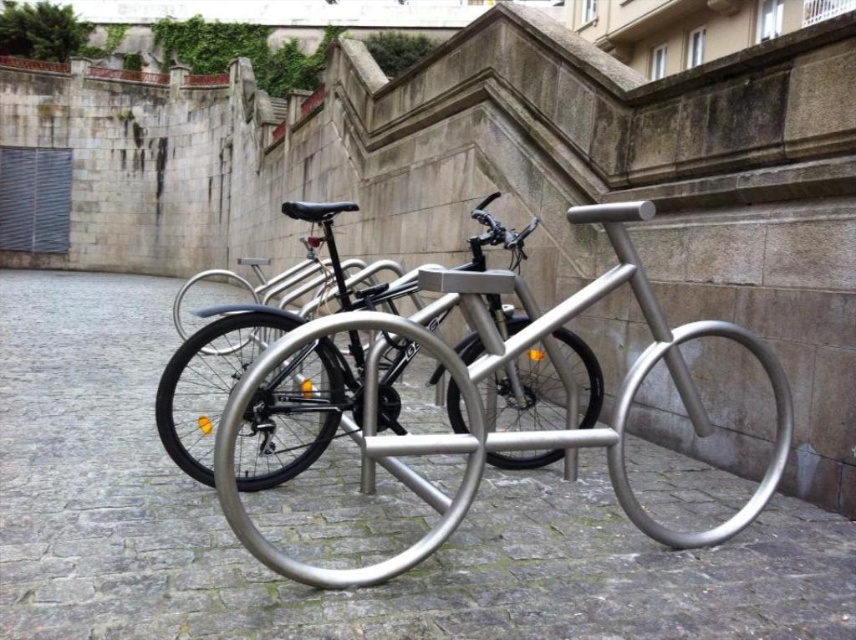
Does silver metallic bike rack at center have a larger size compared to polished silver bicycle at center?

Actually, silver metallic bike rack at center might be smaller than polished silver bicycle at center.

Which of these two, silver metallic bike rack at center or polished silver bicycle at center, stands shorter?

silver metallic bike rack at center

The height and width of the screenshot is (640, 856). What do you see at coordinates (333, 592) in the screenshot? I see `silver metallic bike rack at center` at bounding box center [333, 592].

The image size is (856, 640). Find the location of `silver metallic bike rack at center`. silver metallic bike rack at center is located at coordinates (333, 592).